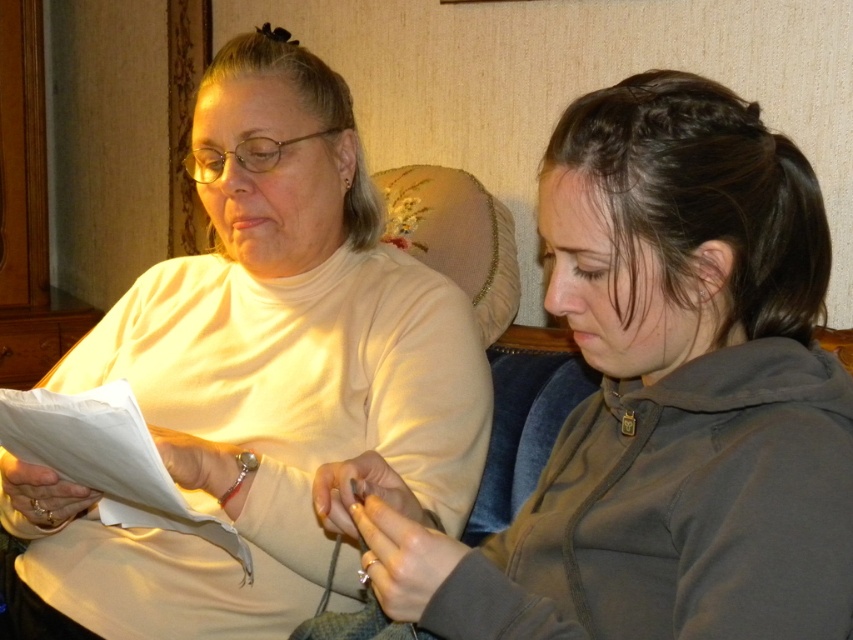
You are a photographer trying to capture a candid shot of both the matte gray hoodie at right and the white paper at left without moving the subjects. Since you can only focus on one subject at a time, which one should you focus on to ensure the other is still in the frame?

You should focus on the matte gray hoodie at right because it is positioned to the right of the white paper at left, so keeping the hoodie in focus will naturally include the white paper at left within the frame.

You are a delivery person who needs to place a small package on the table between the matte white sweater at center and the white paper at left. Which object should you move to make space?

The matte white sweater at center is larger in size than the white paper at left, so you should move the matte white sweater at center to make space for the package.

You are a delivery robot with a 24 inch wide package. You need to pass between the two people sitting at point (x=569, y=148). Can you fit through the space between them?

The two people are 31.16 inches apart, so the delivery robot with a 24 inch wide package can fit through the space between them since 31.16 inches is wider than the package.